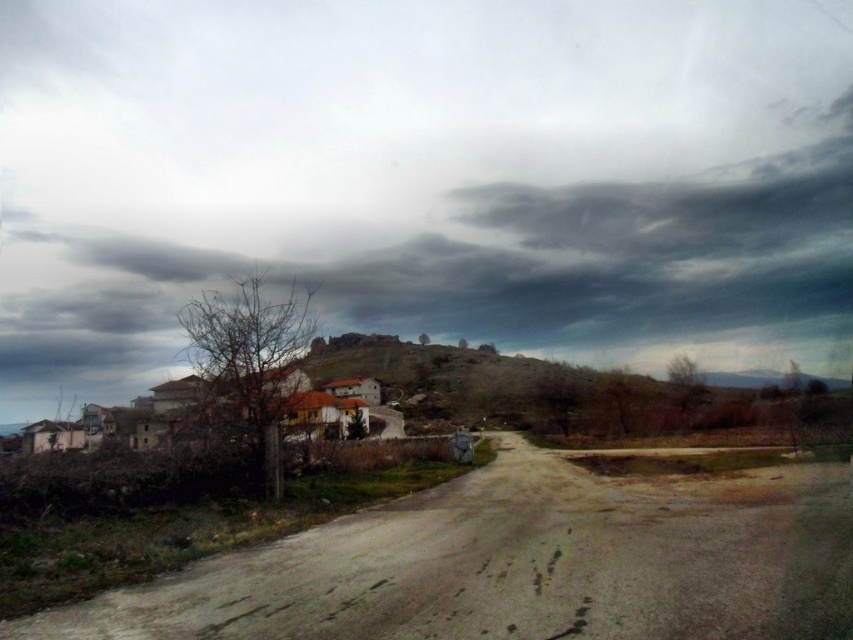
Question: Is the position of dull gray concrete road at center less distant than that of brown stone hill at center?

Choices:
 (A) no
 (B) yes

Answer: (B)

Question: Can you confirm if dull gray concrete road at center is positioned below brown stone hill at center?

Choices:
 (A) yes
 (B) no

Answer: (B)

Question: Where is dark gray cloud at upper center located in relation to dull gray concrete road at center in the image?

Choices:
 (A) below
 (B) above

Answer: (B)

Question: Among these points, which one is nearest to the camera?

Choices:
 (A) (229, 608)
 (B) (576, 406)
 (C) (811, 269)

Answer: (A)

Question: Among these objects, which one is nearest to the camera?

Choices:
 (A) dull gray concrete road at center
 (B) brown stone hill at center

Answer: (A)

Question: Which of the following is the closest to the observer?

Choices:
 (A) dull gray concrete road at center
 (B) dark gray cloud at upper center
 (C) brown stone hill at center

Answer: (A)